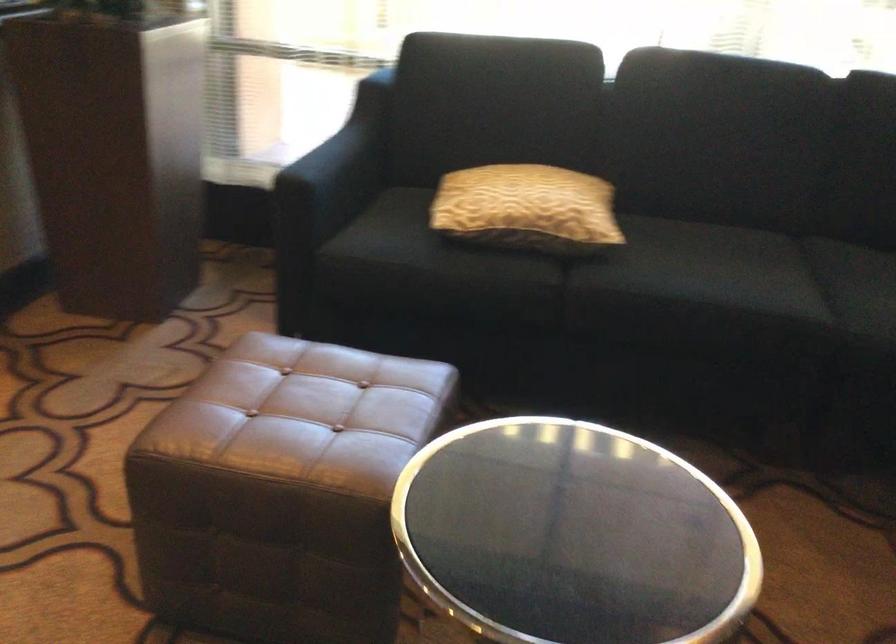
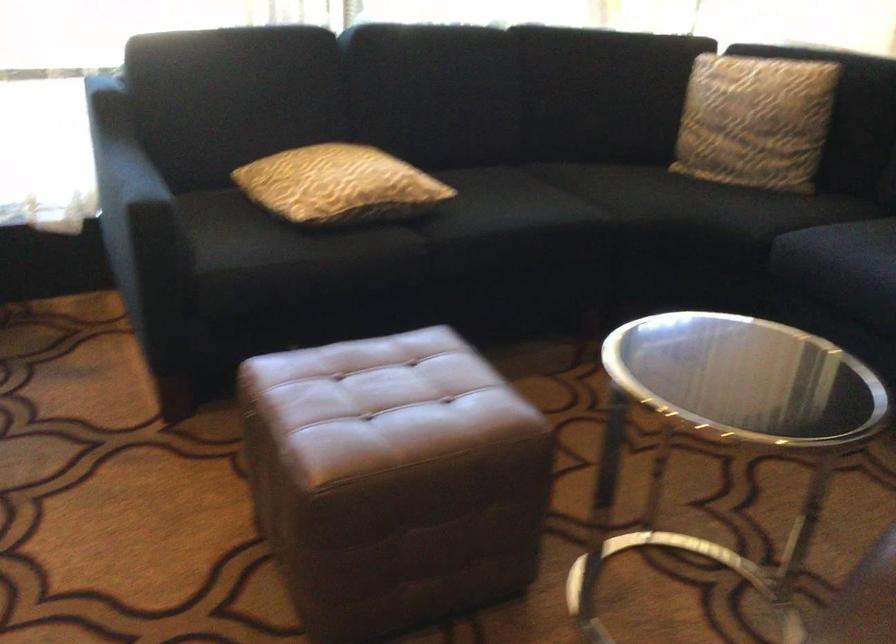
The point at (586, 270) is marked in the first image. Where is the corresponding point in the second image?

(426, 227)